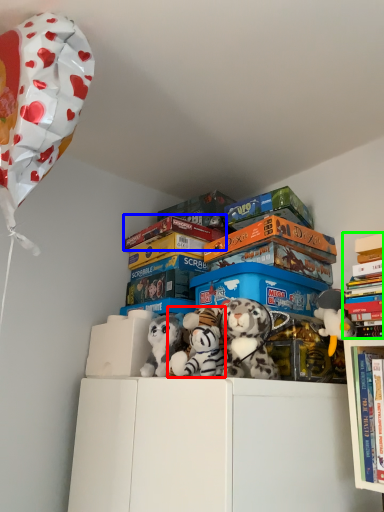
Question: Which object is positioned farthest from toy (highlighted by a red box)? Select from book (highlighted by a blue box) and book (highlighted by a green box).

Choices:
 (A) book
 (B) book

Answer: (A)